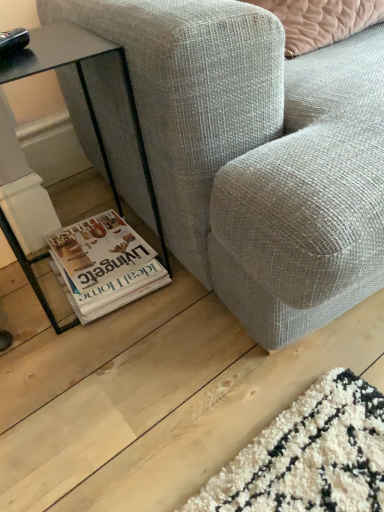
Question: In the image, is black glass table at lower left positioned in front of or behind textured gray fabric couch at lower center?

Choices:
 (A) behind
 (B) front

Answer: (A)

Question: Is black glass table at lower left taller or shorter than textured gray fabric couch at lower center?

Choices:
 (A) tall
 (B) short

Answer: (B)

Question: Considering the real-world distances, which object is farthest from the white glossy magazine at lower left?

Choices:
 (A) textured gray fabric couch at lower center
 (B) black glass table at lower left

Answer: (A)

Question: Which of these objects is positioned closest to the white glossy magazine at lower left?

Choices:
 (A) textured gray fabric couch at lower center
 (B) black glass table at lower left

Answer: (B)